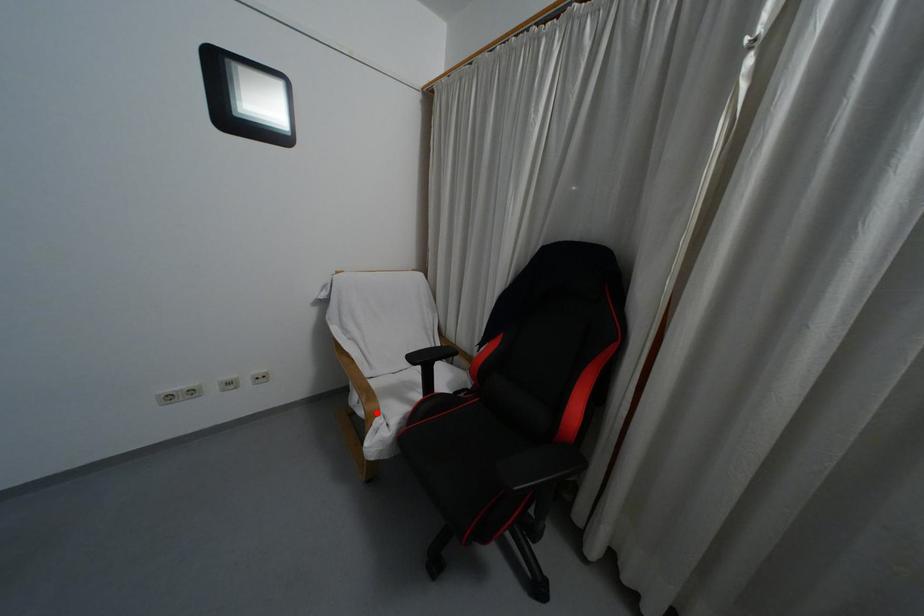
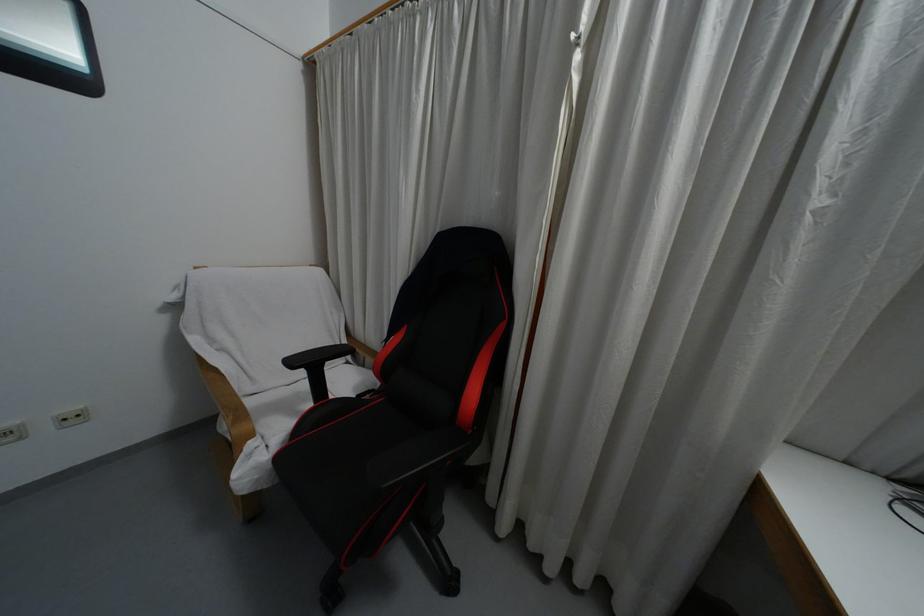
In the second image, find the point that corresponds to the highlighted location in the first image.

(250, 435)